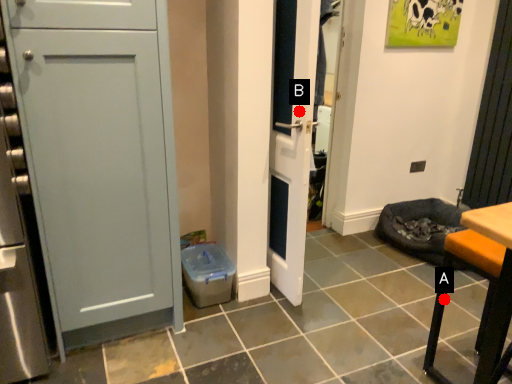
Question: Two points are circled on the image, labeled by A and B beside each circle. Which point is closer to the camera taking this photo?

Choices:
 (A) A is closer
 (B) B is closer

Answer: (A)